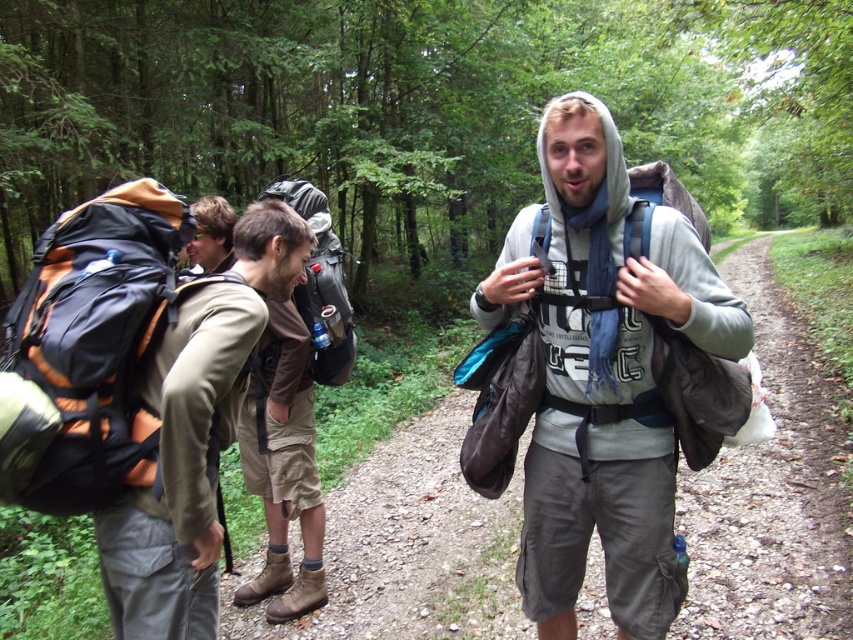
From the picture: You are a hiker who wants to choose a backpack that is shorter in height. Looking at the orange fabric backpack at left and the matte black backpack at center, which one should you pick?

The orange fabric backpack at left has a lesser height compared to the matte black backpack at center, so you should pick the orange fabric backpack at left.

You are standing at the starting point of the hiking trail and see the point marked at coordinates (x=195, y=435). What object is located at this point?

The point at coordinates (x=195, y=435) corresponds to the matte khaki pants at center.